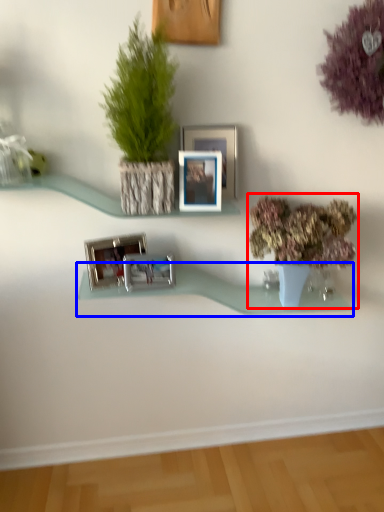
Question: Among these objects, which one is nearest to the camera, houseplant (highlighted by a red box) or shelf (highlighted by a blue box)?

Choices:
 (A) houseplant
 (B) shelf

Answer: (A)